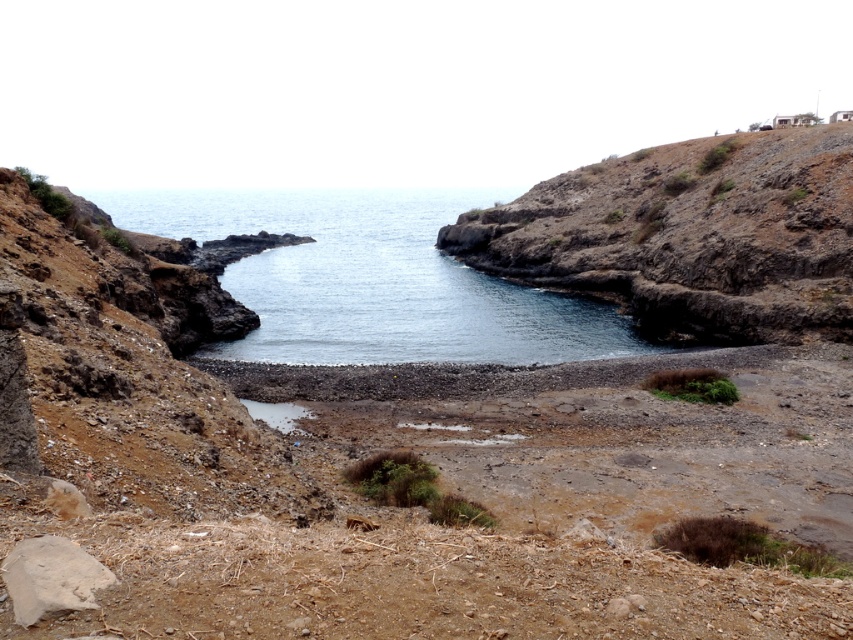
You are a hiker who wants to cross the cove but must avoid getting your boots dirty. You see the dull brown dirt at left and the brown rough rock at lower left. Which surface should you step on to stay clean?

The dull brown dirt at left is positioned over brown rough rock at lower left, so stepping on the brown rough rock at lower left would keep your boots cleaner as it is the lower surface and likely less muddy.